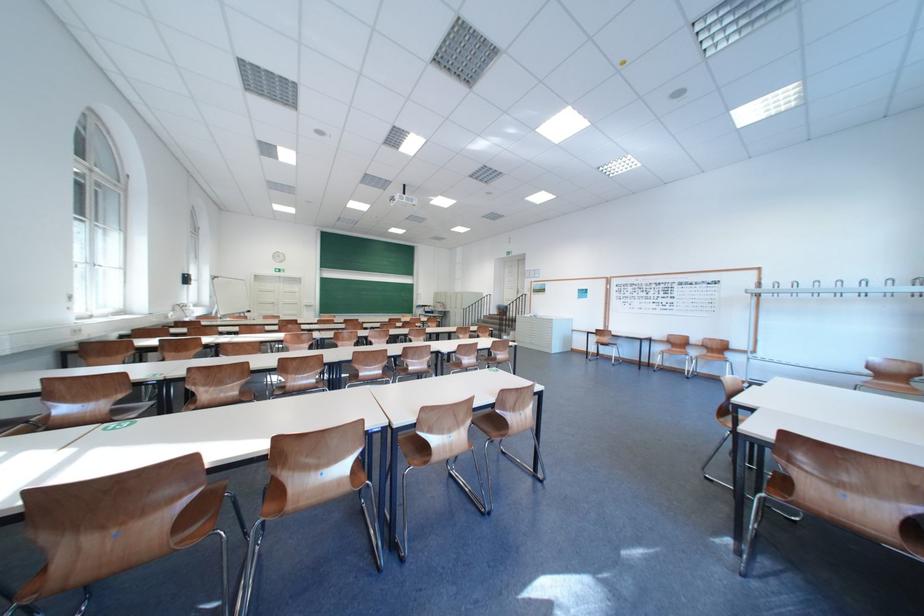
Identify the location of white door handle. This screenshot has width=924, height=616. (275, 302).